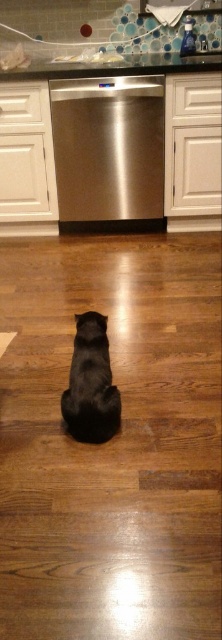
Is stainless steel dishwasher at center to the right of glassy countertop at upper center from the viewer's perspective?

Incorrect, stainless steel dishwasher at center is not on the right side of glassy countertop at upper center.

Who is shorter, stainless steel dishwasher at center or glassy countertop at upper center?

glassy countertop at upper center

Which is behind, point (146, 122) or point (27, 74)?

Point (146, 122)

Find the location of `stainless steel dishwasher at center`. stainless steel dishwasher at center is located at coordinates (109, 152).

How far apart are shiny black cat at center and glassy countertop at upper center?

They are 1.85 meters apart.

Who is more forward, (83, 413) or (136, 65)?

Point (83, 413) is in front.

Is point (109, 364) behind point (138, 67)?

No, (109, 364) is closer to viewer.

The width and height of the screenshot is (222, 640). Find the location of `shiny black cat at center`. shiny black cat at center is located at coordinates (91, 384).

Does stainless steel dishwasher at center appear under shiny black cat at center?

No, stainless steel dishwasher at center is not below shiny black cat at center.

Who is higher up, stainless steel dishwasher at center or shiny black cat at center?

stainless steel dishwasher at center is higher up.

Between point (69, 163) and point (93, 316), which one is positioned behind?

Point (69, 163)

This screenshot has width=222, height=640. I want to click on stainless steel dishwasher at center, so click(x=109, y=152).